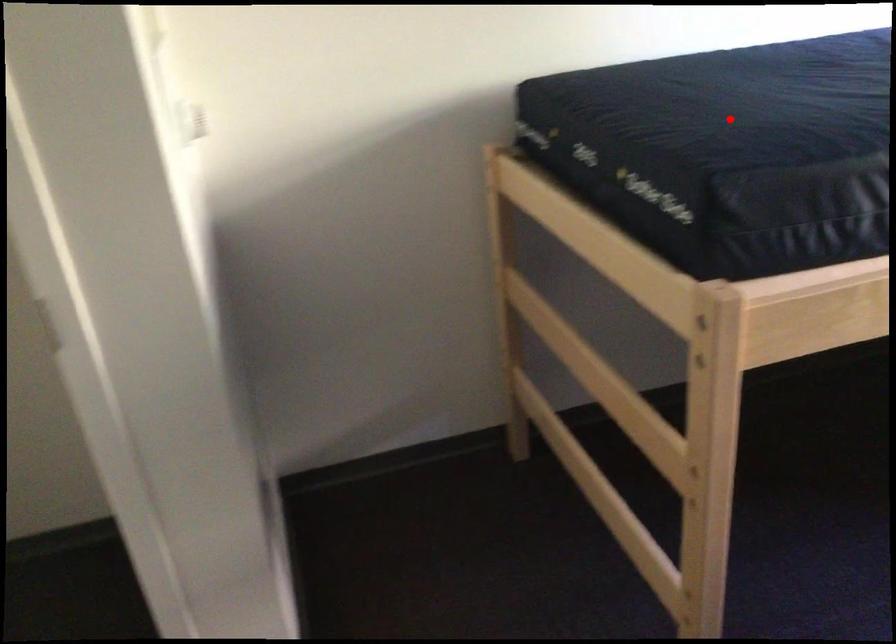
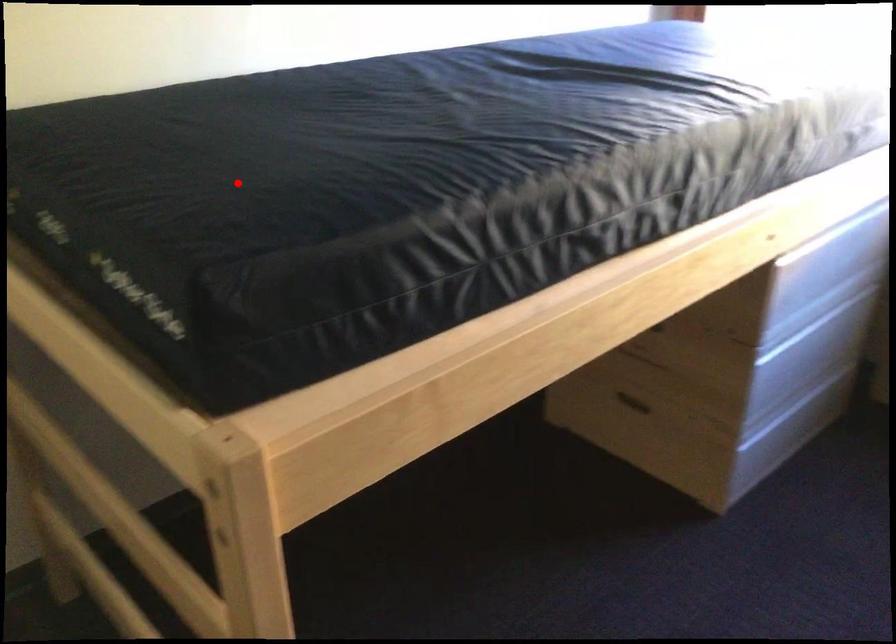
I am providing you with two images of the same scene from different viewpoints. A red point is marked on the first image and another point is marked on the second image. Is the marked point in image1 the same physical position as the marked point in image2?

Yes